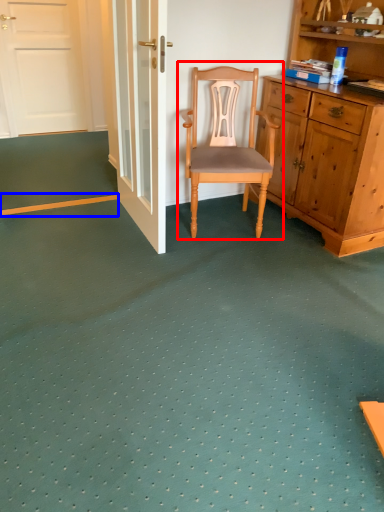
Question: Which of the following is the closest to the observer, chair (highlighted by a red box) or strip (highlighted by a blue box)?

Choices:
 (A) chair
 (B) strip

Answer: (A)